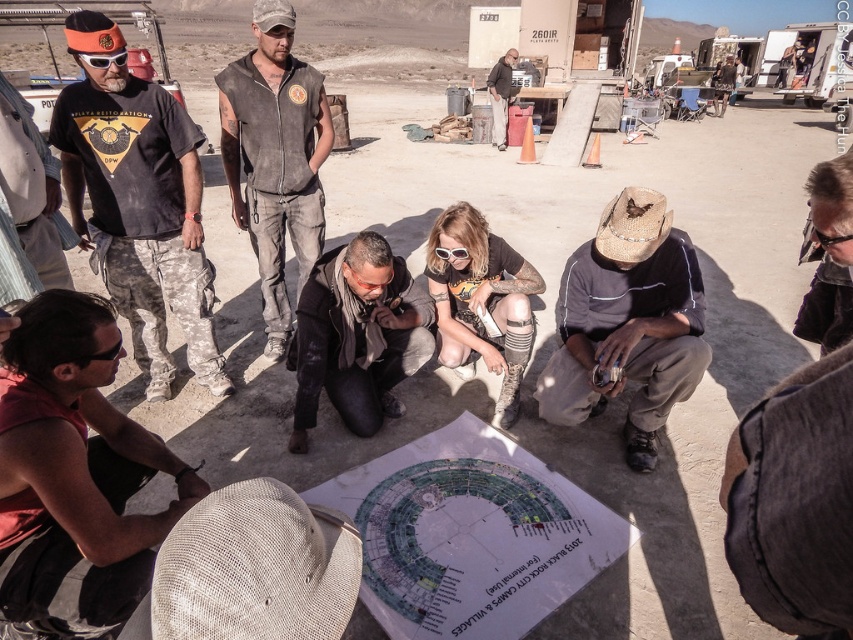
You are standing at the origin point in the desert scene. The matte black goggles at upper left are located at coordinates 0.094 on the x and 0.123 on the y. If you want to move towards the goggles, which direction should you move in terms of x and y coordinates?

To reach the matte black goggles at upper left located at coordinates x 0.094 and y 0.123, you should move towards the positive x and positive y directions since both coordinates are greater than zero.

You are a safety inspector at the worksite and need to ensure that all protective gear is properly positioned. You notice the matte black goggles at upper left and the white plastic goggles at center. Which pair of goggles is positioned higher in the image?

The matte black goggles at upper left is positioned higher in the image than the white plastic goggles at center.